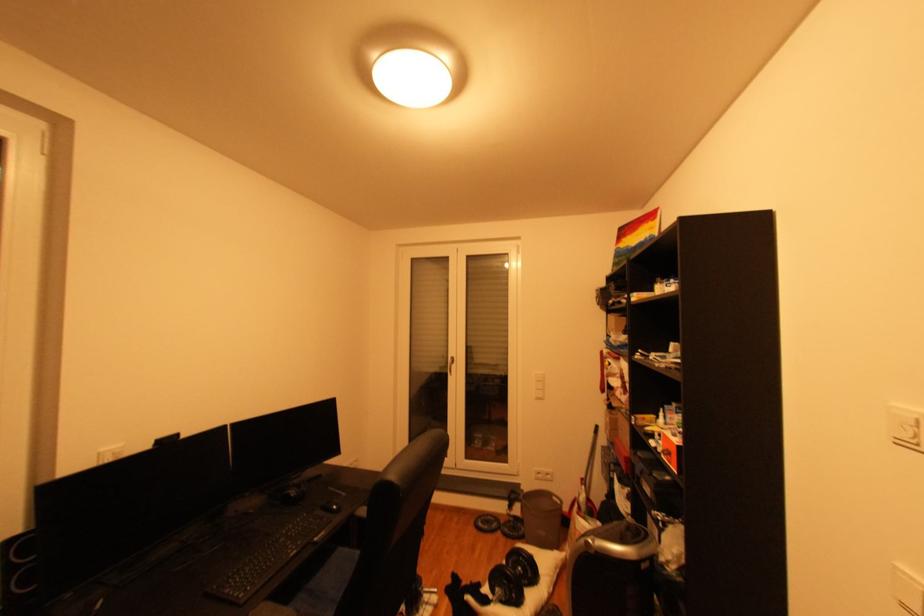
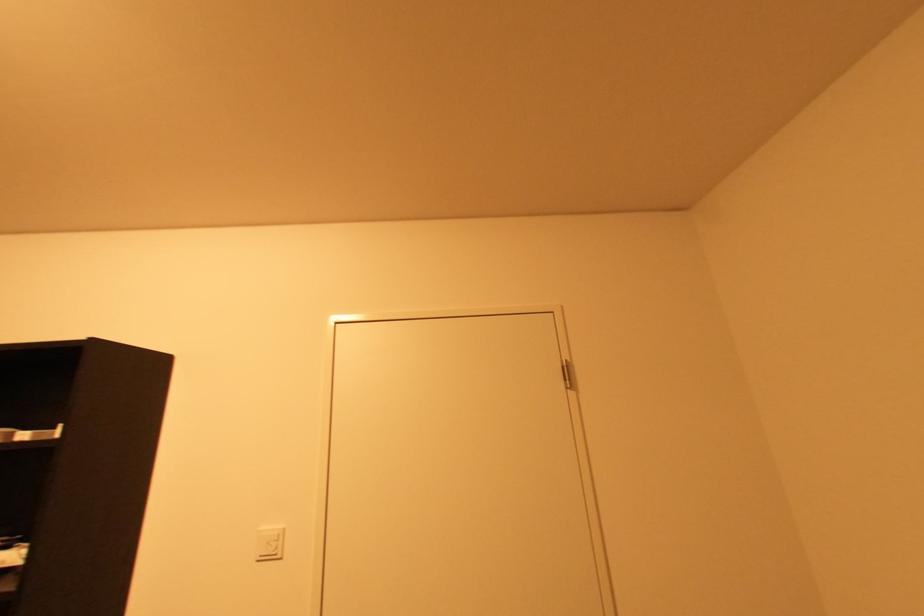
First-person continuous shooting, in which direction is the camera rotating?

The camera rotated toward right-up.